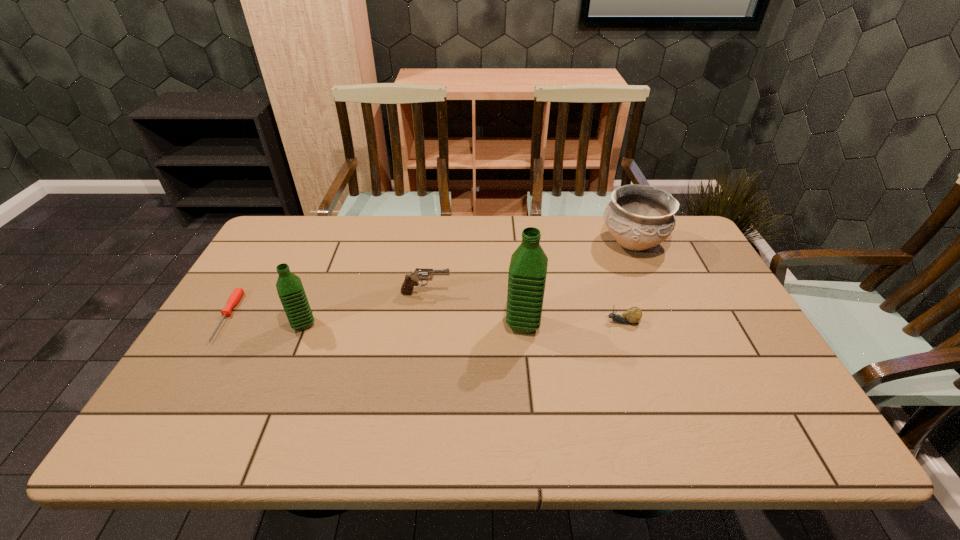
Locate an element on the screen. The width and height of the screenshot is (960, 540). the left water bottle is located at coordinates 289,286.

The height and width of the screenshot is (540, 960). I want to click on the second object from left to right, so click(x=289, y=286).

Where is `the tallest object`? the tallest object is located at coordinates (527, 273).

Find the location of a particular element. The height and width of the screenshot is (540, 960). the third object from right to left is located at coordinates (527, 273).

Identify the location of the farthest object. (639, 217).

Where is `the third tallest object`? This screenshot has width=960, height=540. the third tallest object is located at coordinates (639, 217).

This screenshot has height=540, width=960. I want to click on pistol, so click(x=411, y=280).

Image resolution: width=960 pixels, height=540 pixels. In order to click on the third shortest object in this screenshot , I will do `click(411, 280)`.

Where is `screwdriver`? This screenshot has width=960, height=540. screwdriver is located at coordinates (235, 297).

Locate an element on the screen. the shortest object is located at coordinates (235, 297).